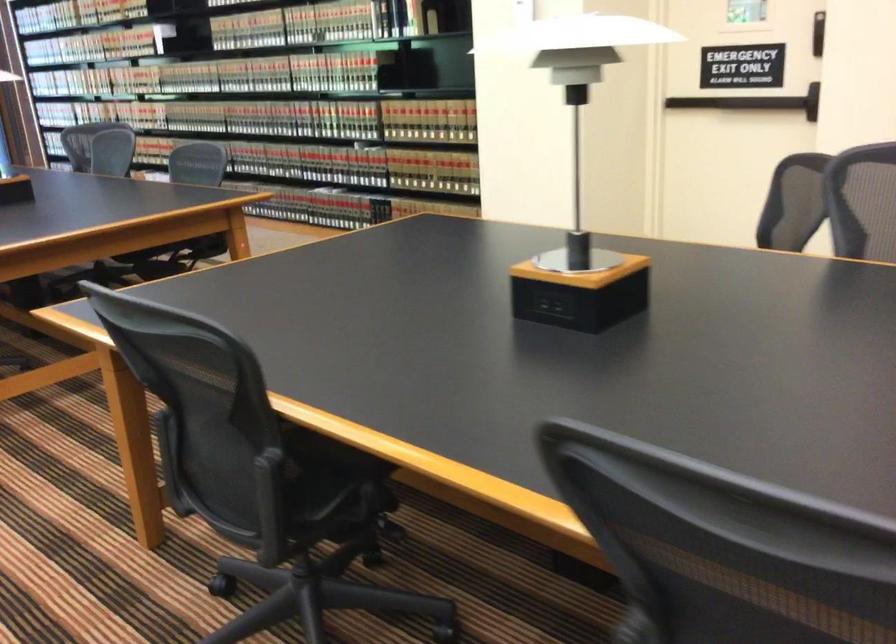
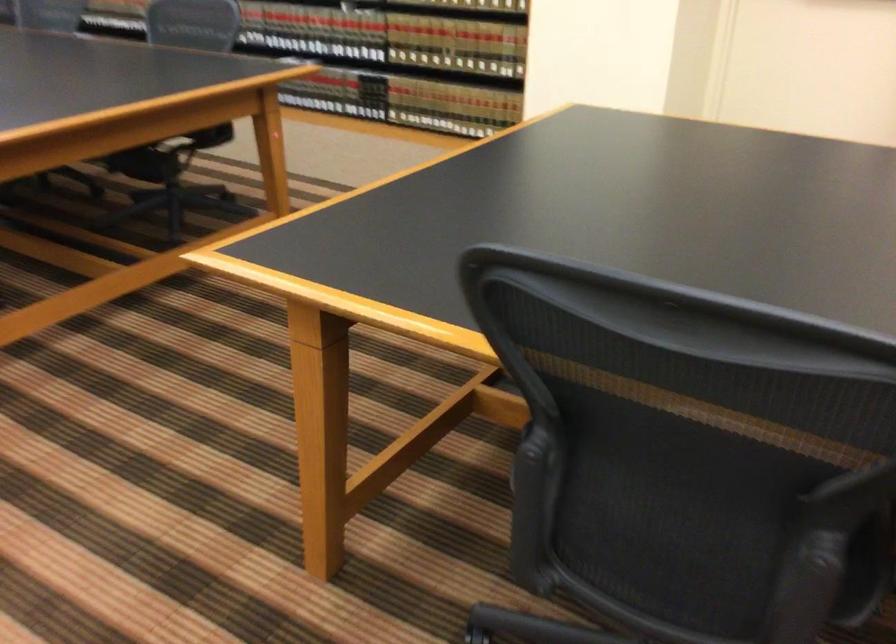
Which direction would the cameraman need to move to produce the second image?

The cameraman moved toward left, forward.